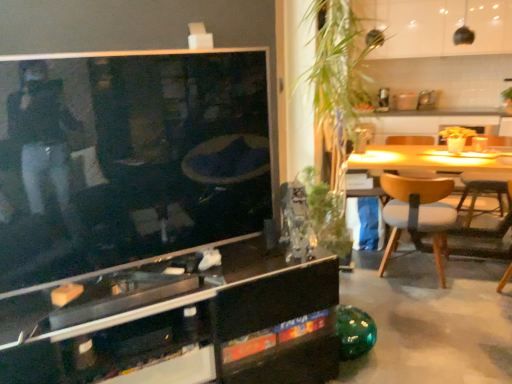
Identify the location of green leafy plant at center, which is the 2th plant in bottom-to-top order. (335, 83).

Identify the location of light brown wood chair at right, placed as the first chair when sorted from left to right. This screenshot has width=512, height=384. (418, 214).

Locate an element on the screen. Image resolution: width=512 pixels, height=384 pixels. green glass vase at center, marked as the 2th plant in a top-to-bottom arrangement is located at coordinates (327, 218).

Find the location of a particular element. The image size is (512, 384). green leafy plant at center, which is the first plant in top-to-bottom order is located at coordinates (335, 83).

Is green leafy plant at center, which is the 2th plant in bottom-to-top order, at the right side of black glass cabinet at center?

Yes, green leafy plant at center, which is the 2th plant in bottom-to-top order, is to the right of black glass cabinet at center.

Is green leafy plant at center, which is the first plant in top-to-bottom order, not within black glass cabinet at center?

green leafy plant at center, which is the first plant in top-to-bottom order, is positioned outside black glass cabinet at center.

From the image's perspective, is green leafy plant at center, which is the 2th plant in bottom-to-top order, positioned above or below black glass cabinet at center?

Clearly, from the image's perspective, green leafy plant at center, which is the 2th plant in bottom-to-top order, is above black glass cabinet at center.

Is point (376, 232) closer or farther from the camera than point (170, 351)?

Point (376, 232) is positioned farther from the camera compared to point (170, 351).

How many degrees apart are the facing directions of light brown wood chair at right, placed as the first chair when sorted from left to right, and green leafy plant at center, which is the first plant in top-to-bottom order?

78.7 degrees.

Considering the positions of points (436, 259) and (355, 99), is point (436, 259) farther from camera compared to point (355, 99)?

Yes, point (436, 259) is farther from viewer.

Is light brown wood chair at right, placed as the first chair when sorted from left to right, not inside green leafy plant at center, which is the first plant in top-to-bottom order?

Indeed, light brown wood chair at right, placed as the first chair when sorted from left to right, is completely outside green leafy plant at center, which is the first plant in top-to-bottom order.

In the image, is light brown wood chair at right, acting as the 2th chair starting from the right, positioned in front of or behind green leafy plant at center, which is the 2th plant in bottom-to-top order?

Visually, light brown wood chair at right, acting as the 2th chair starting from the right, is located behind green leafy plant at center, which is the 2th plant in bottom-to-top order.

From a real-world perspective, between black glass cabinet at center and green glass vase at center, the 1th plant in the bottom-to-top sequence, who is vertically higher?

From a 3D spatial view, green glass vase at center, the 1th plant in the bottom-to-top sequence, is above.

Considering the relative sizes of black glass cabinet at center and green glass vase at center, the 1th plant in the bottom-to-top sequence, in the image provided, is black glass cabinet at center bigger than green glass vase at center, the 1th plant in the bottom-to-top sequence,?

Indeed, black glass cabinet at center has a larger size compared to green glass vase at center, the 1th plant in the bottom-to-top sequence.

Which object is thinner, black glass cabinet at center or green glass vase at center, the 1th plant in the bottom-to-top sequence?

green glass vase at center, the 1th plant in the bottom-to-top sequence, is thinner.

From a real-world perspective, count 1st chairs downward from the green glass vase at center, the 1th plant in the bottom-to-top sequence, and point to it. Please provide its 2D coordinates.

[(482, 189)]

Between wooden chair at right, placed as the 1th chair when sorted from back to front, and green glass vase at center, marked as the 2th plant in a top-to-bottom arrangement, which one has smaller size?

green glass vase at center, marked as the 2th plant in a top-to-bottom arrangement.

Is wooden chair at right, which ranks as the second chair in left-to-right order, shorter than green glass vase at center, marked as the 2th plant in a top-to-bottom arrangement?

Yes, wooden chair at right, which ranks as the second chair in left-to-right order, is shorter than green glass vase at center, marked as the 2th plant in a top-to-bottom arrangement.

Which object is more forward, wooden chair at right, which ranks as the 2th chair in front-to-back order, or green glass vase at center, marked as the 2th plant in a top-to-bottom arrangement?

green glass vase at center, marked as the 2th plant in a top-to-bottom arrangement, is in front.

Between black glass cabinet at center and green leafy plant at center, which is the first plant in top-to-bottom order, which one has larger width?

With larger width is green leafy plant at center, which is the first plant in top-to-bottom order.

From a real-world perspective, between black glass cabinet at center and green leafy plant at center, which is the 2th plant in bottom-to-top order, who is vertically lower?

black glass cabinet at center is physically lower.

Consider the image. Is black glass cabinet at center beside green leafy plant at center, which is the 2th plant in bottom-to-top order?

No, black glass cabinet at center is not in contact with green leafy plant at center, which is the 2th plant in bottom-to-top order.

Considering the relative positions of black glass cabinet at center and green leafy plant at center, which is the 2th plant in bottom-to-top order, in the image provided, is black glass cabinet at center to the left or to the right of green leafy plant at center, which is the 2th plant in bottom-to-top order,?

From the image, it's evident that black glass cabinet at center is to the left of green leafy plant at center, which is the 2th plant in bottom-to-top order.

Which object is positioned more to the left, wooden chair at right, which ranks as the 2th chair in front-to-back order, or light brown wood chair at right, positioned as the second chair in back-to-front order?

light brown wood chair at right, positioned as the second chair in back-to-front order.

Is wooden chair at right, which ranks as the second chair in left-to-right order, turned away from light brown wood chair at right, positioned as the second chair in back-to-front order?

No, wooden chair at right, which ranks as the second chair in left-to-right order,'s orientation is not away from light brown wood chair at right, positioned as the second chair in back-to-front order.

Is light brown wood chair at right, which is the 1th chair in front-to-back order, located within wooden chair at right, which ranks as the second chair in left-to-right order?

Actually, light brown wood chair at right, which is the 1th chair in front-to-back order, is outside wooden chair at right, which ranks as the second chair in left-to-right order.

From the image's perspective, is wooden chair at right, which ranks as the 2th chair in front-to-back order, located above or below light brown wood chair at right, which is the 1th chair in front-to-back order?

wooden chair at right, which ranks as the 2th chair in front-to-back order, is above light brown wood chair at right, which is the 1th chair in front-to-back order.

From the image's perspective, would you say green leafy plant at center, which is the first plant in top-to-bottom order, is positioned over wooden chair at right, marked as the 1th chair in a right-to-left arrangement?

Yes, from the image's perspective, green leafy plant at center, which is the first plant in top-to-bottom order, is over wooden chair at right, marked as the 1th chair in a right-to-left arrangement.

Who is smaller, green leafy plant at center, which is the 2th plant in bottom-to-top order, or wooden chair at right, marked as the 1th chair in a right-to-left arrangement?

Smaller between the two is wooden chair at right, marked as the 1th chair in a right-to-left arrangement.

Is green leafy plant at center, which is the first plant in top-to-bottom order, far away from wooden chair at right, marked as the 1th chair in a right-to-left arrangement?

Yes, green leafy plant at center, which is the first plant in top-to-bottom order, and wooden chair at right, marked as the 1th chair in a right-to-left arrangement, are quite far apart.

In the scene shown: Would you say green leafy plant at center, which is the 2th plant in bottom-to-top order, is to the left or to the right of wooden chair at right, marked as the 1th chair in a right-to-left arrangement, in the picture?

In the image, green leafy plant at center, which is the 2th plant in bottom-to-top order, appears on the left side of wooden chair at right, marked as the 1th chair in a right-to-left arrangement.

Where is `plant that is the 2nd one when counting upward from the black glass cabinet at center (from the image's perspective)`? The image size is (512, 384). plant that is the 2nd one when counting upward from the black glass cabinet at center (from the image's perspective) is located at coordinates (335, 83).

The width and height of the screenshot is (512, 384). What are the coordinates of `chair that is the 1st object located behind the green leafy plant at center, which is the first plant in top-to-bottom order` in the screenshot? It's located at (418, 214).

From the image, which object appears to be farther from green glass vase at center, the 1th plant in the bottom-to-top sequence, green leafy plant at center, which is the first plant in top-to-bottom order, or wooden chair at right, which ranks as the second chair in left-to-right order?

wooden chair at right, which ranks as the second chair in left-to-right order, is positioned further to the anchor green glass vase at center, the 1th plant in the bottom-to-top sequence.

Which object lies nearer to the anchor point wooden chair at right, which ranks as the second chair in left-to-right order, green leafy plant at center, which is the first plant in top-to-bottom order, or green glass vase at center, the 1th plant in the bottom-to-top sequence?

green glass vase at center, the 1th plant in the bottom-to-top sequence, is positioned closer to the anchor wooden chair at right, which ranks as the second chair in left-to-right order.

Looking at the image, which one is located closer to black glass cabinet at center, green glass vase at center, the 1th plant in the bottom-to-top sequence, or light brown wood chair at right, which is the 1th chair in front-to-back order?

Among the two, green glass vase at center, the 1th plant in the bottom-to-top sequence, is located nearer to black glass cabinet at center.

Based on the photo, when comparing their distances from black glass cabinet at center, does wooden chair at right, placed as the 1th chair when sorted from back to front, or green glass vase at center, the 1th plant in the bottom-to-top sequence, seem further?

wooden chair at right, placed as the 1th chair when sorted from back to front, lies further to black glass cabinet at center than the other object.

Considering their positions, is green glass vase at center, the 1th plant in the bottom-to-top sequence, positioned closer to light brown wood chair at right, which is the 1th chair in front-to-back order, than green leafy plant at center, which is the first plant in top-to-bottom order?

green glass vase at center, the 1th plant in the bottom-to-top sequence, is closer to light brown wood chair at right, which is the 1th chair in front-to-back order.

Which object lies nearer to the anchor point green glass vase at center, marked as the 2th plant in a top-to-bottom arrangement, black glass cabinet at center or light brown wood chair at right, which is the 1th chair in front-to-back order?

light brown wood chair at right, which is the 1th chair in front-to-back order.

Which object lies nearer to the anchor point wooden chair at right, which ranks as the second chair in left-to-right order, black glass cabinet at center or green leafy plant at center, which is the 2th plant in bottom-to-top order?

green leafy plant at center, which is the 2th plant in bottom-to-top order, is closer to wooden chair at right, which ranks as the second chair in left-to-right order.

Based on their spatial positions, is wooden chair at right, placed as the 1th chair when sorted from back to front, or light brown wood chair at right, positioned as the second chair in back-to-front order, closer to green leafy plant at center, which is the first plant in top-to-bottom order?

Among the two, light brown wood chair at right, positioned as the second chair in back-to-front order, is located nearer to green leafy plant at center, which is the first plant in top-to-bottom order.

Identify the location of plant between green glass vase at center, marked as the 2th plant in a top-to-bottom arrangement, and light brown wood chair at right, positioned as the second chair in back-to-front order. Image resolution: width=512 pixels, height=384 pixels. (335, 83).

Image resolution: width=512 pixels, height=384 pixels. I want to click on plant between green glass vase at center, marked as the 2th plant in a top-to-bottom arrangement, and wooden chair at right, marked as the 1th chair in a right-to-left arrangement, in the horizontal direction, so coord(335,83).

Where is `chair between black glass cabinet at center and wooden chair at right, marked as the 1th chair in a right-to-left arrangement, in the horizontal direction`? The width and height of the screenshot is (512, 384). chair between black glass cabinet at center and wooden chair at right, marked as the 1th chair in a right-to-left arrangement, in the horizontal direction is located at coordinates (418, 214).

Image resolution: width=512 pixels, height=384 pixels. I want to click on chair located between green glass vase at center, marked as the 2th plant in a top-to-bottom arrangement, and wooden chair at right, placed as the 1th chair when sorted from back to front, in the left-right direction, so point(418,214).